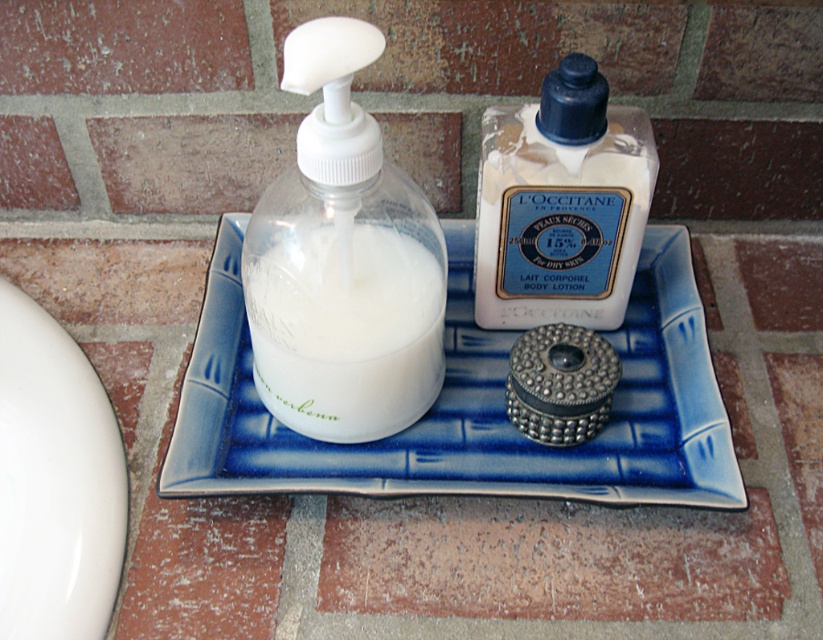
You are organizing a bathroom shelf and have two items to place side by side. The white opaque liquid at center and the white matte lotion at center. Which one should you place first if you want to arrange them from widest to narrowest?

The white opaque liquid at center should be placed first because its width surpasses the white matte lotion at center, making it wider.